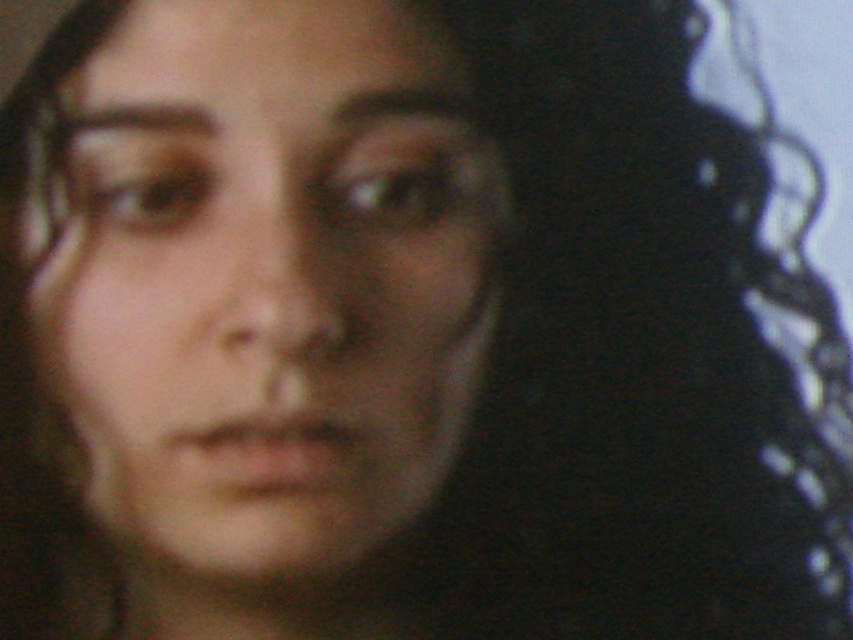
You are a photographer trying to adjust the focus of your camera. You want to ensure both the matte black eye at center and the brown matte eye at upper left are in focus. Given that your camera has a depth of field that can cover 1.5 inches, will both eyes be in focus?

The distance between the matte black eye at center and the brown matte eye at upper left is 1.79 inches. Since the depth of field can only cover 1.5 inches, both eyes may not be fully in focus.

You are a photographer adjusting the focus of a portrait. You notice the smooth skin face at center and the matte black eye at center. Which object should you focus on to ensure the subject looks sharp and well defined?

The smooth skin face at center is in front of the matte black eye at center, so focusing on the smooth skin face at center will ensure the subject looks sharp and well defined.

Based on the photo, based on the scene description, which object has a larger height measurement between the smooth skin face at center and the brown matte eye at upper left?

The smooth skin face at center has a greater height compared to the brown matte eye at upper left according to the description.